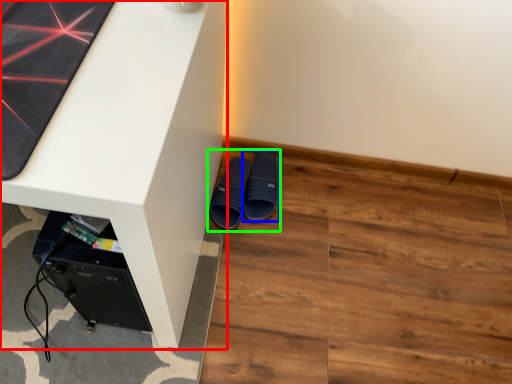
Question: Which object is the farthest from desk (highlighted by a red box)? Choose among these: footwear (highlighted by a blue box) or footwear (highlighted by a green box).

Choices:
 (A) footwear
 (B) footwear

Answer: (A)